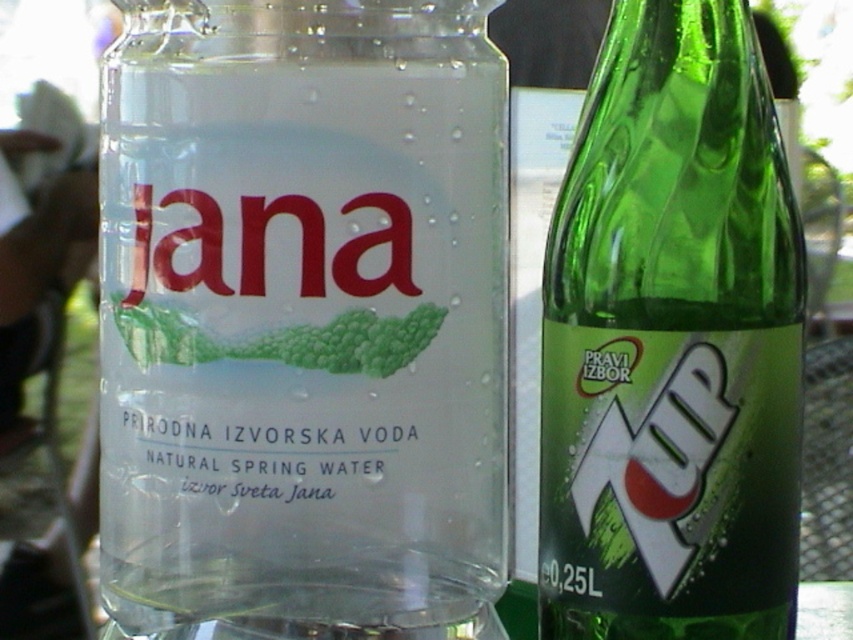
Question: Can you confirm if transparent glass bottle at center is positioned to the right of green glass bottle at right?

Choices:
 (A) no
 (B) yes

Answer: (A)

Question: Which object appears farthest from the camera in this image?

Choices:
 (A) green glass bottle at right
 (B) transparent glass bottle at center

Answer: (B)

Question: Which of the following is the closest to the observer?

Choices:
 (A) green glass bottle at right
 (B) transparent glass bottle at center

Answer: (A)

Question: Is transparent glass bottle at center above green glass bottle at right?

Choices:
 (A) no
 (B) yes

Answer: (B)

Question: Does transparent glass bottle at center have a greater width compared to green glass bottle at right?

Choices:
 (A) no
 (B) yes

Answer: (B)